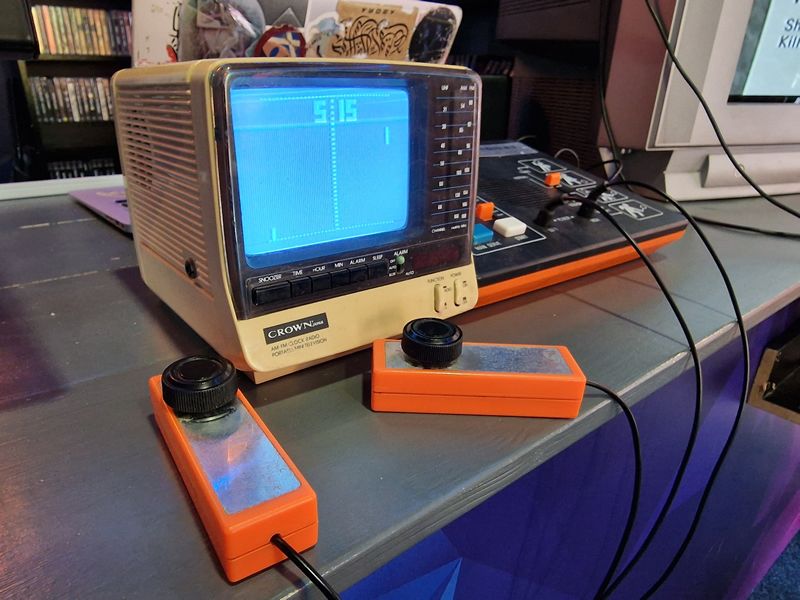
At what (x,y) coordinates should I click in order to perform the action: click on tv. Please return your answer as a coordinate pair (x, y). The image size is (800, 600). Looking at the image, I should click on (289, 142).